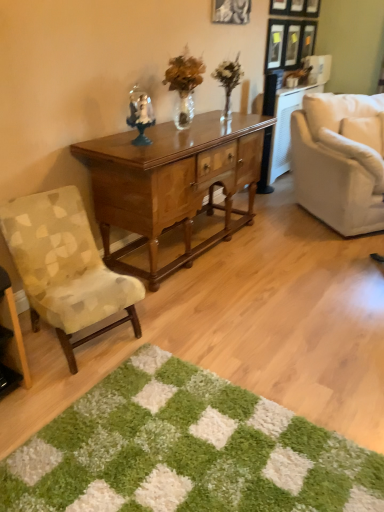
Question: Relative to green shaggy rug at lower center, is patterned fabric chair at left, which is the 1th chair from front to back, in front or behind?

Choices:
 (A) front
 (B) behind

Answer: (B)

Question: Does point (81, 294) appear closer or farther from the camera than point (132, 496)?

Choices:
 (A) farther
 (B) closer

Answer: (A)

Question: Which object is positioned closest to the white fabric chair at right, which is the first chair from right to left?

Choices:
 (A) polished wood desk at center
 (B) black matte picture frame at upper center
 (C) green shaggy rug at lower center
 (D) translucent glass vase at center
 (E) patterned fabric chair at left, which appears as the second chair when viewed from the back

Answer: (D)

Question: Considering the real-world distances, which object is farthest from the translucent glass vase at center?

Choices:
 (A) green shaggy rug at lower center
 (B) white fabric chair at right, the second chair from the bottom
 (C) patterned fabric chair at left, which ranks as the second chair in top-to-bottom order
 (D) black matte picture frame at upper center
 (E) polished wood desk at center

Answer: (A)